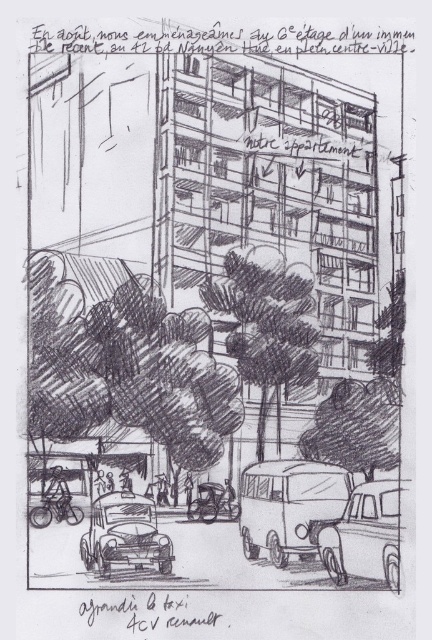
What is the significance of the point located at coordinates (266,332) in the urban street scene?

The point at coordinates (266,332) marks the location of a charcoal textured tree at center.

You are a delivery person trying to park your truck next to the matte gray van at center and the matte black taxi at lower left. Which vehicle should you park closer to if you need more space on the other side?

You should park closer to the matte gray van at center because it has a lesser width compared to the matte black taxi at lower left, leaving more space available on the other side.

You are an architect reviewing a city layout design. You notice two points marked in the sketch at coordinates point (257, 474) and point (111, 493). Based on the spatial relationship between these points, which point is closer to the viewer in the sketch?

Point (257, 474) is in front of point (111, 493), so it is closer to the viewer.